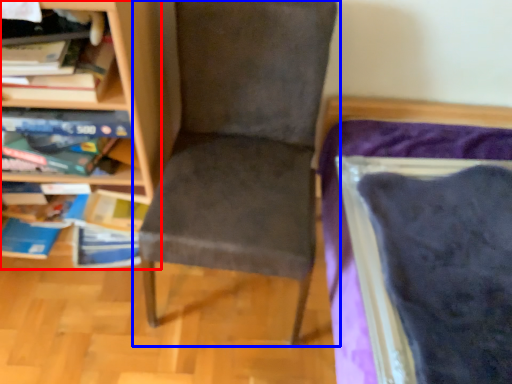
Question: Which object appears closest to the camera in this image, bookcase (highlighted by a red box) or chair (highlighted by a blue box)?

Choices:
 (A) bookcase
 (B) chair

Answer: (B)